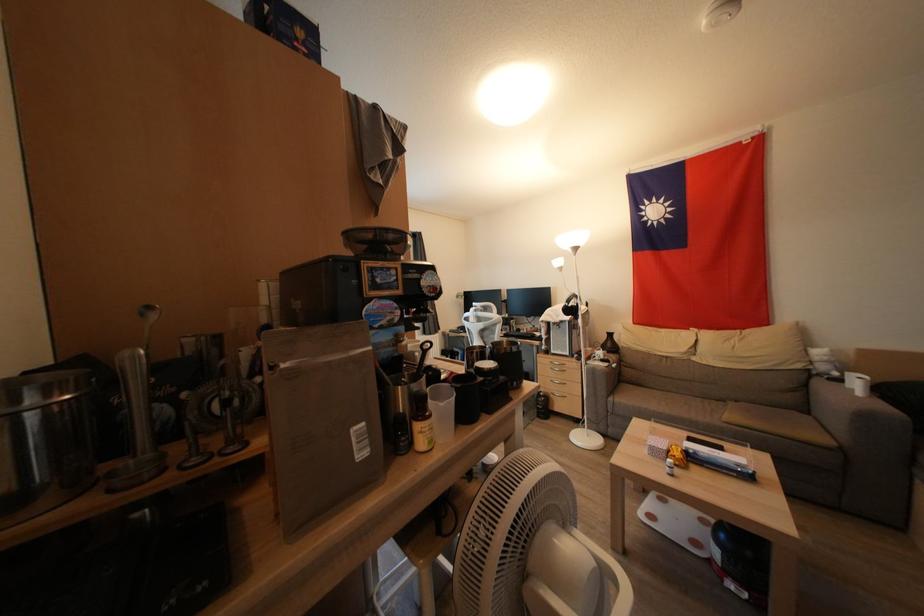
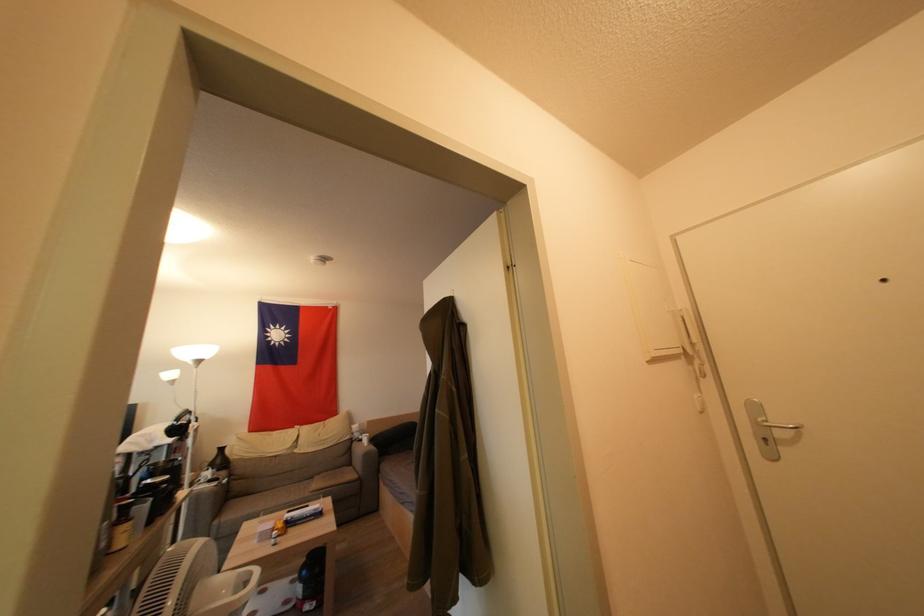
The point at (x=621, y=585) is marked in the first image. Where is the corresponding point in the second image?

(256, 577)